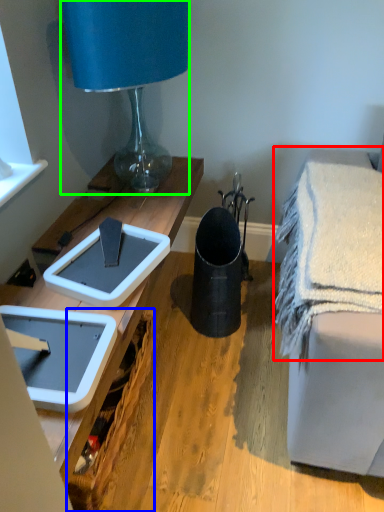
Question: Which object is the closest to the bath towel (highlighted by a red box)? Choose among these: picnic basket (highlighted by a blue box) or lamp (highlighted by a green box).

Choices:
 (A) picnic basket
 (B) lamp

Answer: (A)